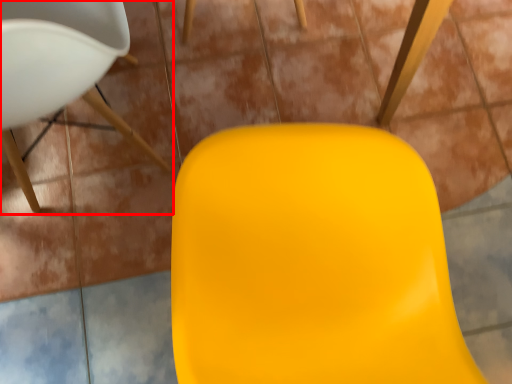
Question: From the image's perspective, where is chair (annotated by the red box) located relative to swivel chair?

Choices:
 (A) below
 (B) above

Answer: (B)